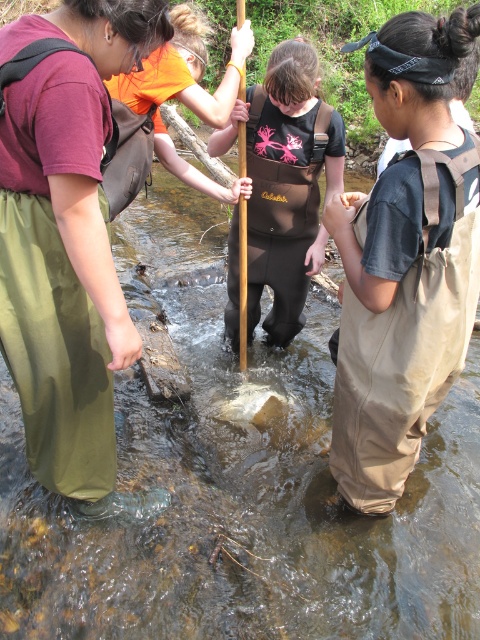
You are standing at the edge of the stream and see the brown fabric waders at center and the wooden paddle at center. Which item is closer to you?

The brown fabric waders at center are positioned over the wooden paddle at center, meaning they are closer to you.

You are standing at the edge of the stream and see the green fabric pants at left and the wooden paddle at center. Which object is closer to you?

The green fabric pants at left is closer to you because it is in front of the wooden paddle at center.